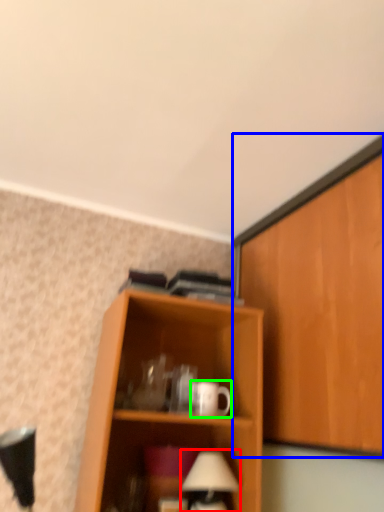
Question: Considering the real-world distances, which object is farthest from table lamp (highlighted by a red box)? cabinetry (highlighted by a blue box) or mug (highlighted by a green box)?

Choices:
 (A) cabinetry
 (B) mug

Answer: (A)